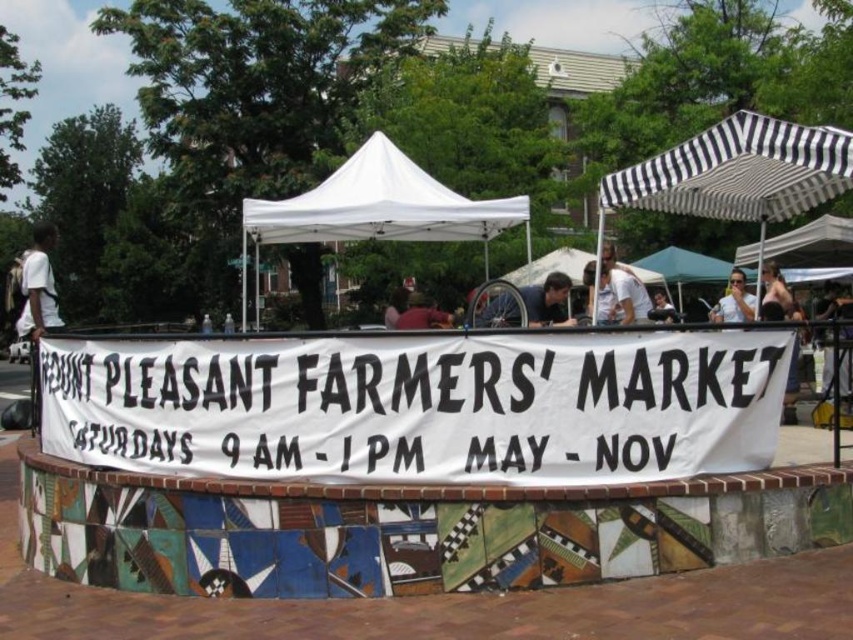
What do you see at coordinates (421, 404) in the screenshot?
I see `white fabric banner at center` at bounding box center [421, 404].

Can you confirm if white fabric banner at center is taller than white fabric tent at center?

Incorrect, white fabric banner at center's height is not larger of white fabric tent at center's.

What are the coordinates of `white fabric banner at center` in the screenshot? It's located at (421, 404).

This screenshot has height=640, width=853. In order to click on white fabric banner at center in this screenshot , I will do `click(421, 404)`.

Does point (556, 349) come farther from viewer compared to point (662, 320)?

No, it is not.

Who is positioned more to the left, white fabric banner at center or smooth skin face at center?

Positioned to the left is white fabric banner at center.

Image resolution: width=853 pixels, height=640 pixels. What are the coordinates of `white fabric banner at center` in the screenshot? It's located at (421, 404).

Which is more to the right, green fabric canopy at center or smooth skin face at center?

green fabric canopy at center is more to the right.

Is point (708, 262) closer to camera compared to point (671, 320)?

No, (708, 262) is further to viewer.

Image resolution: width=853 pixels, height=640 pixels. I want to click on green fabric canopy at center, so click(685, 268).